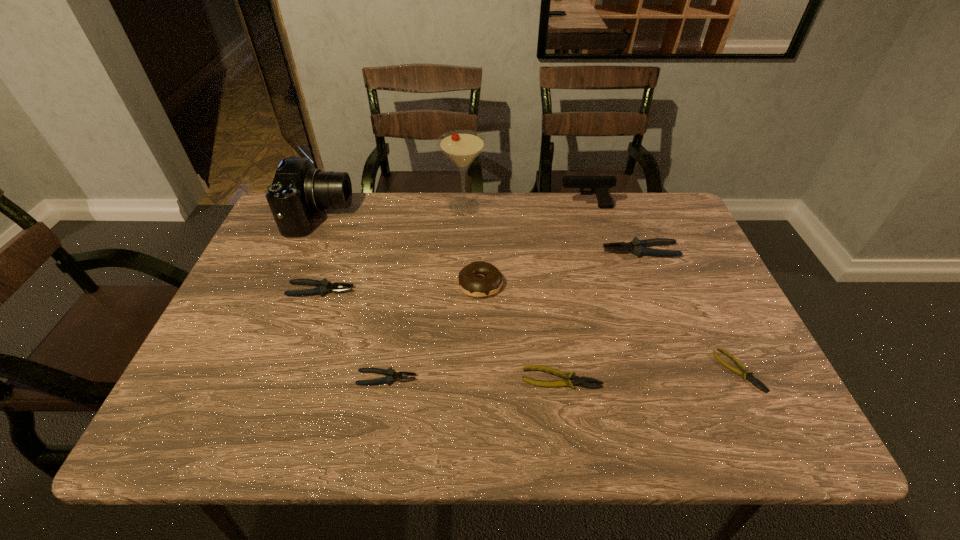
At what (x,y) coordinates should I click in order to perform the action: click on the third tallest pliers. Please return your answer as a coordinate pair (x, y). The width and height of the screenshot is (960, 540). Looking at the image, I should click on [391, 375].

Identify the location of the third pliers from left to right. (582, 381).

Locate an element on the screen. the eighth tallest object is located at coordinates (582, 381).

Where is `the right yellow pliers`? the right yellow pliers is located at coordinates (745, 373).

Image resolution: width=960 pixels, height=540 pixels. Find the location of `the shortest object`. the shortest object is located at coordinates (745, 373).

Where is `free space located 0.120m on the right of the tallest object`? The image size is (960, 540). free space located 0.120m on the right of the tallest object is located at coordinates (525, 207).

You are a GUI agent. You are given a task and a screenshot of the screen. Output one action in this format:
    pyautogui.click(x=<x>, y=<y>)
    Task: Click on the free region located 0.190m on the lens of the camera
    
    Given the screenshot: What is the action you would take?
    pyautogui.click(x=411, y=215)

At what (x,y) coordinates should I click in order to perform the action: click on vacant region located on the front-facing side of the pistol. Please return your answer as a coordinate pair (x, y). Image resolution: width=960 pixels, height=540 pixels. Looking at the image, I should click on (526, 207).

The width and height of the screenshot is (960, 540). In order to click on free space located 0.350m on the front-facing side of the pistol in this screenshot , I will do [x=446, y=207].

Where is `blank area located 0.140m on the front-facing side of the pistol`? The image size is (960, 540). blank area located 0.140m on the front-facing side of the pistol is located at coordinates (514, 207).